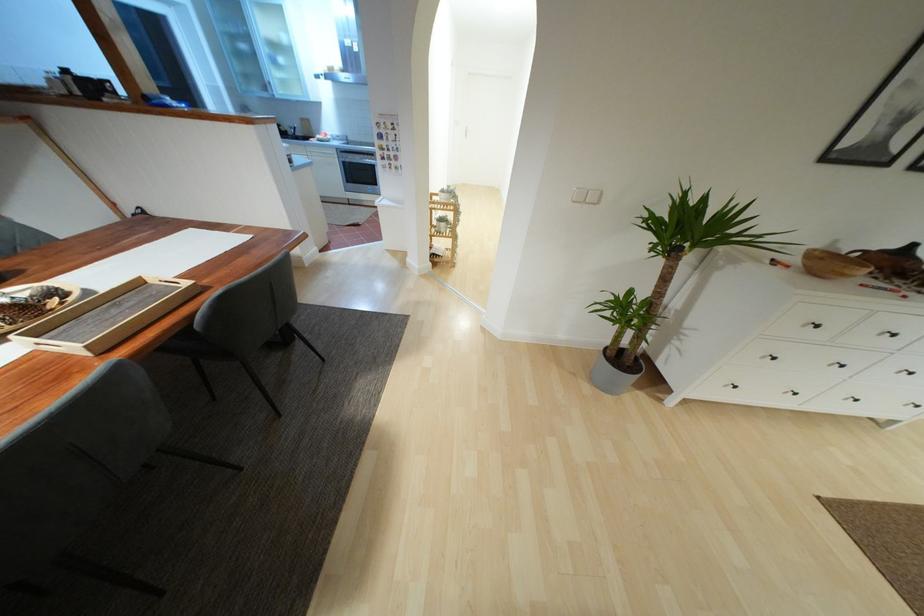
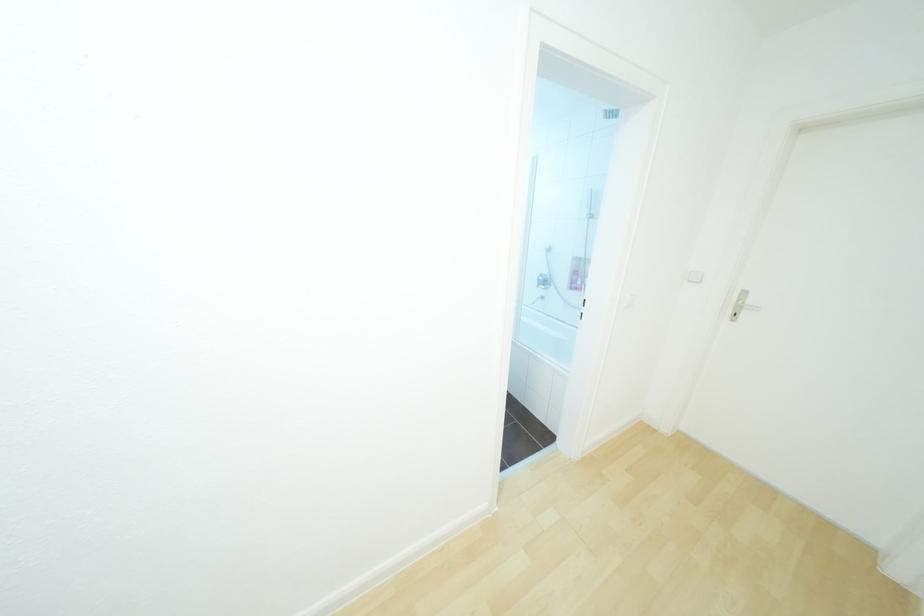
Question: I am providing you with two images of the same scene from different viewpoints. Please identify which objects are invisible in image2.

Choices:
 (A) oven door handle
 (B) white light switch
 (C) red toilet brush handle
 (D) faucet handle

Answer: (A)